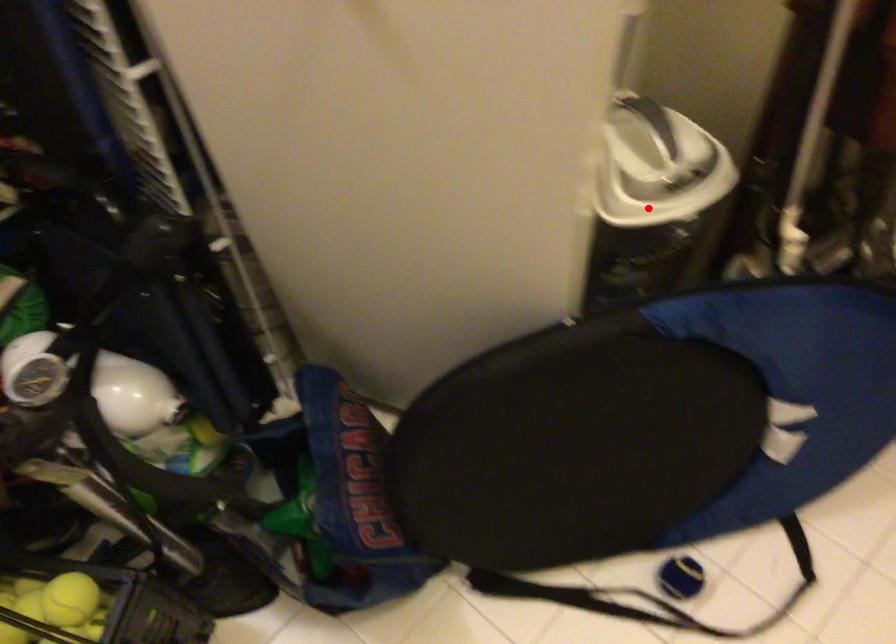
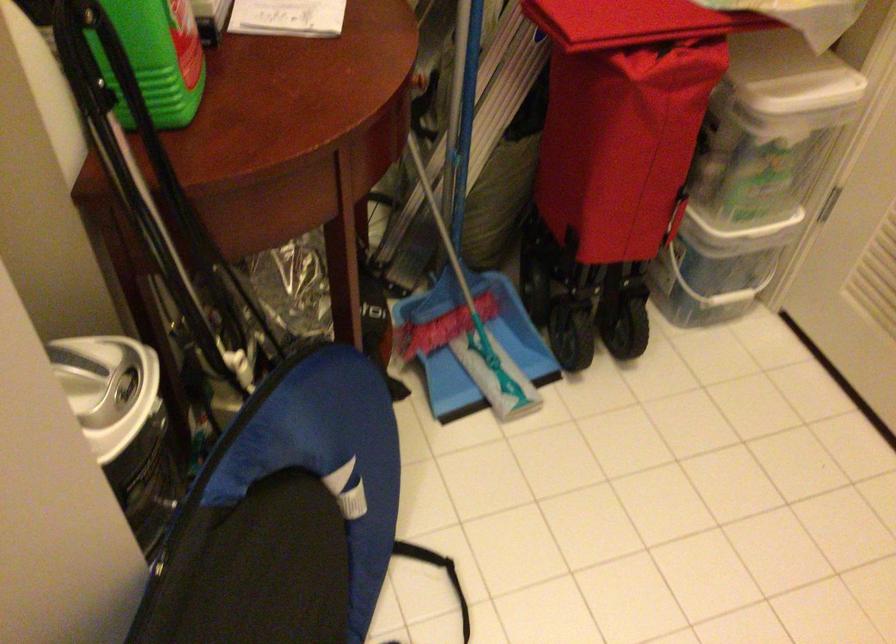
Locate, in the second image, the point that corresponds to the highlighted location in the first image.

(123, 424)